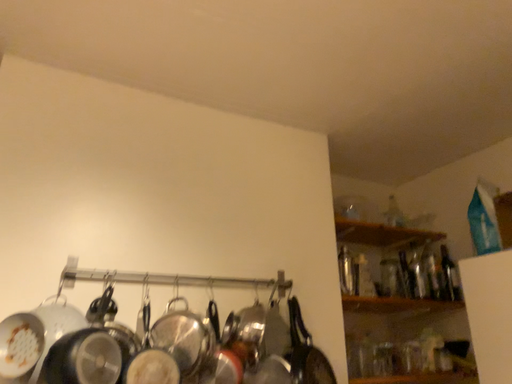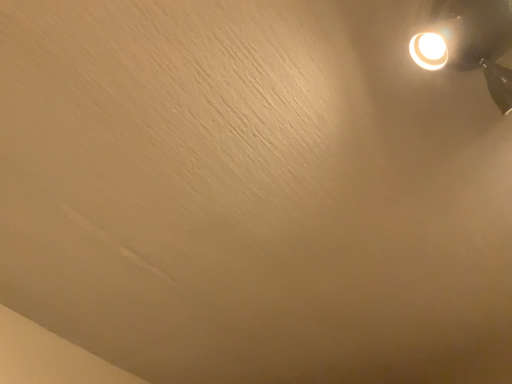
Question: Which way did the camera rotate in the video?

Choices:
 (A) rotated right
 (B) rotated left

Answer: (A)